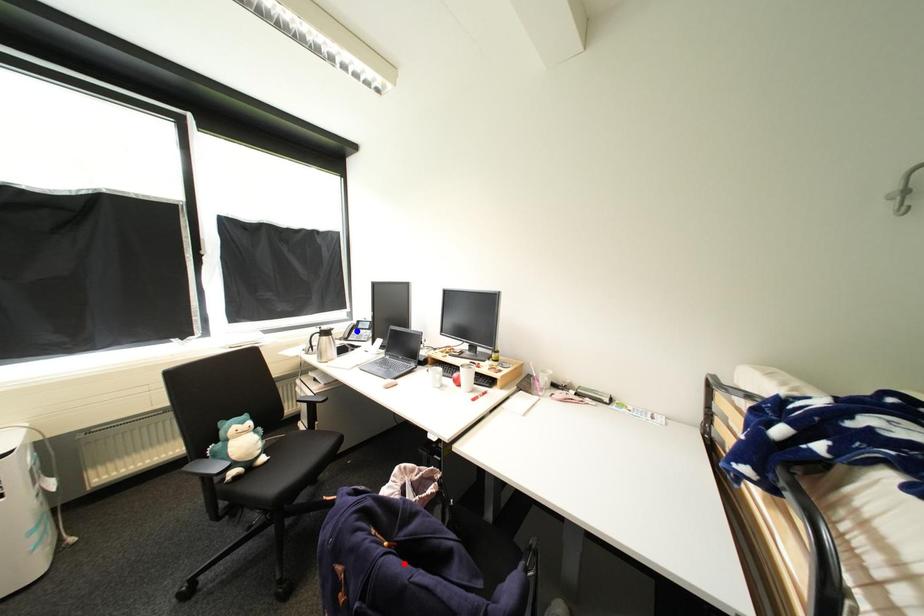
Question: Two points are marked on the image. Which point is closer to the camera?

Choices:
 (A) Blue point is closer.
 (B) Red point is closer.

Answer: (B)